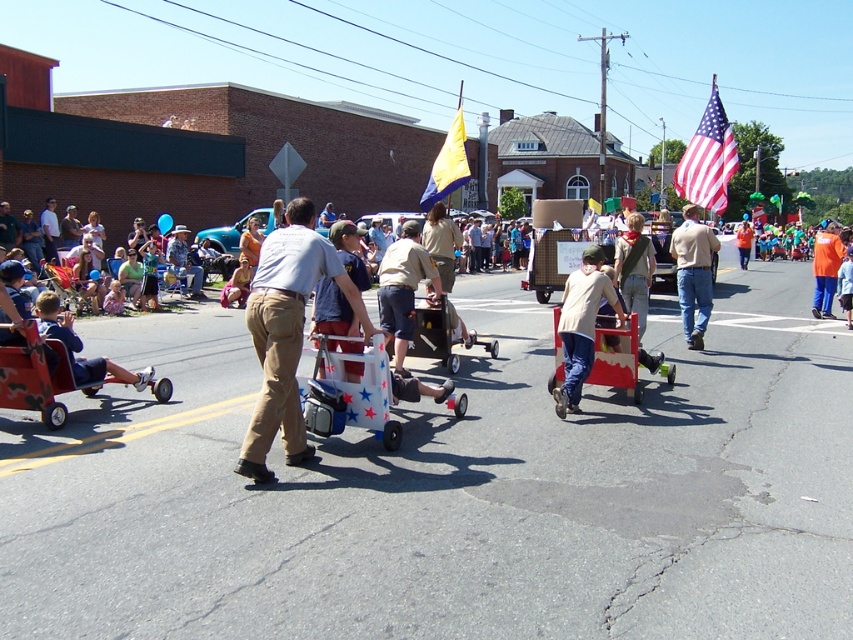
Does point (577, 282) come in front of point (712, 150)?

Yes, point (577, 282) is closer to viewer.

Can you confirm if light brown fabric shirt at center is positioned to the right of american flag at upper right?

No, light brown fabric shirt at center is not to the right of american flag at upper right.

Locate an element on the screen. Image resolution: width=853 pixels, height=640 pixels. light brown fabric shirt at center is located at coordinates (581, 324).

Between camouflage fabric wagon at lower left and light brown pants at center, which one is positioned lower?

Positioned lower is camouflage fabric wagon at lower left.

Can you confirm if camouflage fabric wagon at lower left is thinner than light brown pants at center?

No.

Describe the element at coordinates (41, 378) in the screenshot. This screenshot has height=640, width=853. I see `camouflage fabric wagon at lower left` at that location.

The height and width of the screenshot is (640, 853). I want to click on camouflage fabric wagon at lower left, so click(41, 378).

Looking at this image, can you confirm if camouflage fabric wagon at lower left is thinner than wooden cart at center?

No, camouflage fabric wagon at lower left is not thinner than wooden cart at center.

Does camouflage fabric wagon at lower left have a larger size compared to wooden cart at center?

Yes, camouflage fabric wagon at lower left is bigger than wooden cart at center.

Is point (25, 339) in front of point (616, 360)?

Yes, point (25, 339) is in front of point (616, 360).

At what (x,y) coordinates should I click in order to perform the action: click on camouflage fabric wagon at lower left. Please return your answer as a coordinate pair (x, y). Image resolution: width=853 pixels, height=640 pixels. Looking at the image, I should click on (41, 378).